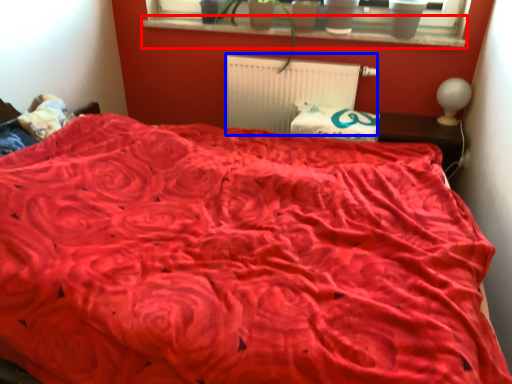
Question: Which of the following is the closest to the observer, window sill (highlighted by a red box) or radiator (highlighted by a blue box)?

Choices:
 (A) window sill
 (B) radiator

Answer: (A)